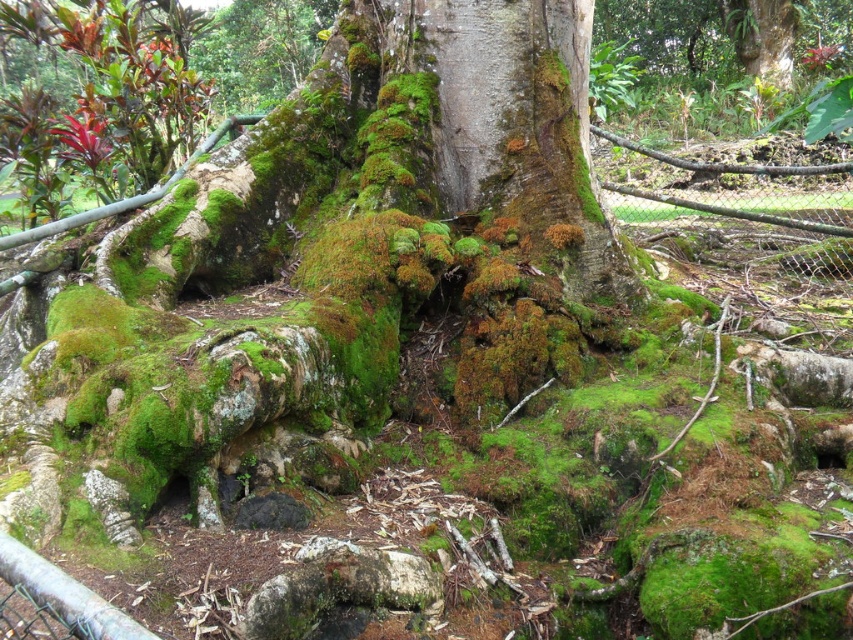
You are a gardener trying to determine which object is smaller between the green mossy bark at center and the wire mesh fence at lower right. Based on the scene, which one is smaller?

The green mossy bark at center is smaller compared to the wire mesh fence at lower right.

You are a gardener trying to determine the best spot to place a new plant. You see the green mossy bark at center and the wire mesh fence at lower right. Which object is positioned lower in the scene?

The green mossy bark at center is located below the wire mesh fence at lower right, so it is positioned lower in the scene.